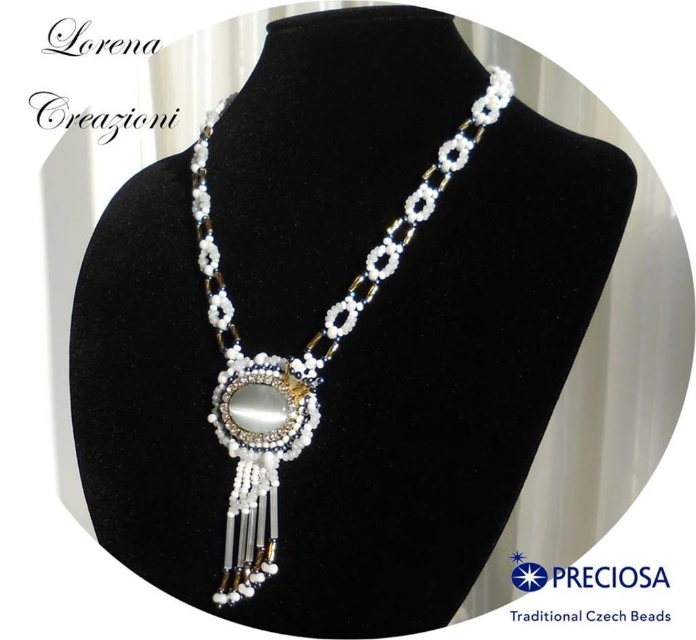
Question: Does white beaded necklace at center appear on the right side of white beaded pendant at center?

Choices:
 (A) yes
 (B) no

Answer: (B)

Question: Is white beaded necklace at center smaller than white beaded pendant at center?

Choices:
 (A) yes
 (B) no

Answer: (B)

Question: Can you confirm if white beaded necklace at center is wider than white beaded pendant at center?

Choices:
 (A) no
 (B) yes

Answer: (B)

Question: Which point is farther to the camera?

Choices:
 (A) (528, 586)
 (B) (216, 595)

Answer: (A)